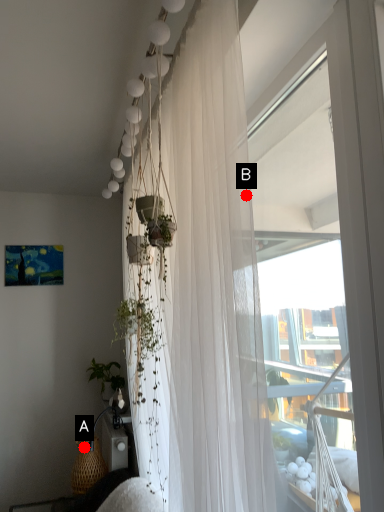
Question: Two points are circled on the image, labeled by A and B beside each circle. Which of the following is the closest to the observer?

Choices:
 (A) A is closer
 (B) B is closer

Answer: (B)